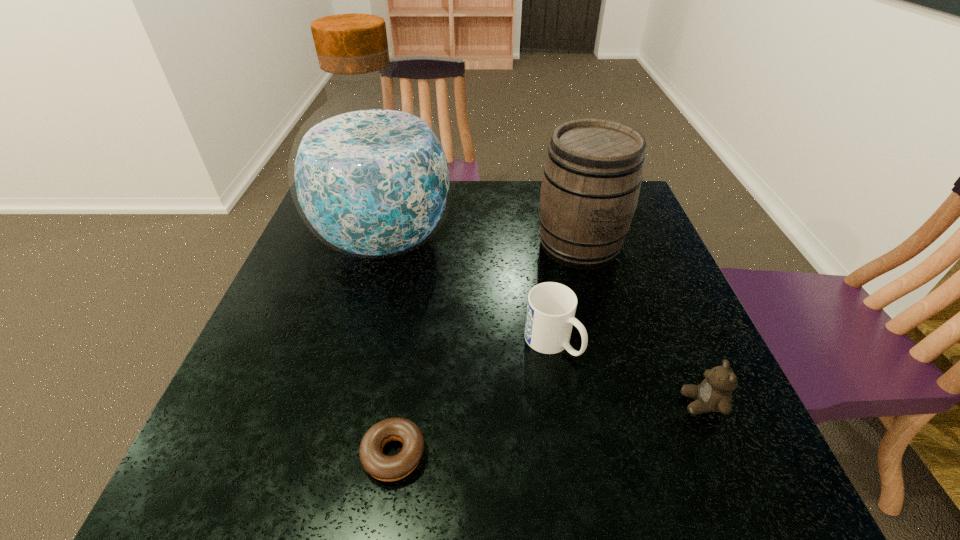
The image size is (960, 540). I want to click on free space that is in between the tallest object and the mug, so click(x=468, y=291).

I want to click on empty space that is in between the teddy bear and the shortest object, so [x=548, y=429].

I want to click on free space between the shortest object and the teddy bear, so click(548, 429).

The image size is (960, 540). In order to click on object that is the second closest to the doughnut in this screenshot , I will do 371,175.

Where is `object that stands as the closest to the tallest object`? This screenshot has height=540, width=960. object that stands as the closest to the tallest object is located at coordinates (551, 307).

Find the location of a particular element. This screenshot has height=540, width=960. vacant space that satisfies the following two spatial constraints: 1. on the face of the teddy bear; 2. on the front side of the shortest object is located at coordinates (723, 455).

Where is `free space that satisfies the following two spatial constraints: 1. on the face of the teddy bear; 2. on the front side of the shortest object`? free space that satisfies the following two spatial constraints: 1. on the face of the teddy bear; 2. on the front side of the shortest object is located at coordinates (723, 455).

The width and height of the screenshot is (960, 540). What are the coordinates of `vacant position in the image that satisfies the following two spatial constraints: 1. on the front side of the second tallest object; 2. on the right side of the water jug` in the screenshot? It's located at (384, 245).